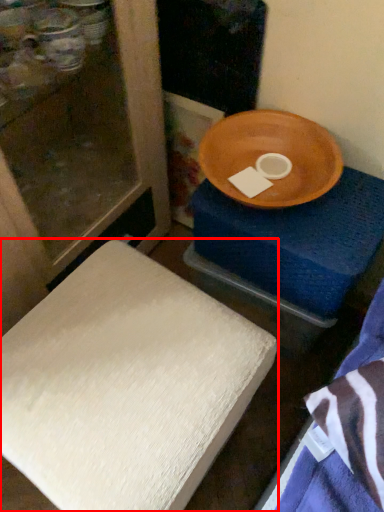
Question: Considering the relative positions of furniture (annotated by the red box) and changing table in the image provided, where is furniture (annotated by the red box) located with respect to the staircase?

Choices:
 (A) left
 (B) right

Answer: (A)